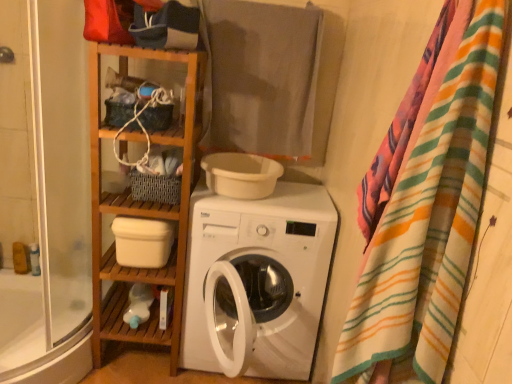
Question: Does gray cotton towel at upper center come behind transparent glass shower door at left?

Choices:
 (A) yes
 (B) no

Answer: (A)

Question: Can you confirm if gray cotton towel at upper center is wider than transparent glass shower door at left?

Choices:
 (A) no
 (B) yes

Answer: (A)

Question: Is gray cotton towel at upper center not near transparent glass shower door at left?

Choices:
 (A) yes
 (B) no

Answer: (B)

Question: Is gray cotton towel at upper center bigger than transparent glass shower door at left?

Choices:
 (A) yes
 (B) no

Answer: (B)

Question: Is gray cotton towel at upper center outside of transparent glass shower door at left?

Choices:
 (A) yes
 (B) no

Answer: (A)

Question: Considering their positions, is white matte washing machine at center located in front of or behind gray cotton towel at upper center?

Choices:
 (A) behind
 (B) front

Answer: (B)

Question: From a real-world perspective, is white matte washing machine at center above or below gray cotton towel at upper center?

Choices:
 (A) above
 (B) below

Answer: (B)

Question: In the image, is white matte washing machine at center on the left side or the right side of gray cotton towel at upper center?

Choices:
 (A) left
 (B) right

Answer: (B)

Question: Considering the positions of point 199,188 and point 207,109, is point 199,188 closer or farther from the camera than point 207,109?

Choices:
 (A) closer
 (B) farther

Answer: (A)

Question: From a real-world perspective, is white matte plastic container at center-left, the 1th shelf ordered from the bottom, physically located above or below white glossy bathtub at lower left?

Choices:
 (A) below
 (B) above

Answer: (B)

Question: Based on their sizes in the image, would you say white matte plastic container at center-left, which ranks as the 2th shelf in top-to-bottom order, is bigger or smaller than white glossy bathtub at lower left?

Choices:
 (A) big
 (B) small

Answer: (B)

Question: From the image's perspective, is white matte plastic container at center-left, which ranks as the 2th shelf in top-to-bottom order, located above or below white glossy bathtub at lower left?

Choices:
 (A) above
 (B) below

Answer: (A)

Question: From their relative heights in the image, would you say white matte plastic container at center-left, the 1th shelf ordered from the bottom, is taller or shorter than white glossy bathtub at lower left?

Choices:
 (A) short
 (B) tall

Answer: (B)

Question: Is point (155, 203) positioned closer to the camera than point (15, 120)?

Choices:
 (A) closer
 (B) farther

Answer: (A)

Question: In terms of width, does woven fabric basket at center, which ranks as the first shelf in top-to-bottom order, look wider or thinner when compared to transparent glass shower door at left?

Choices:
 (A) thin
 (B) wide

Answer: (A)